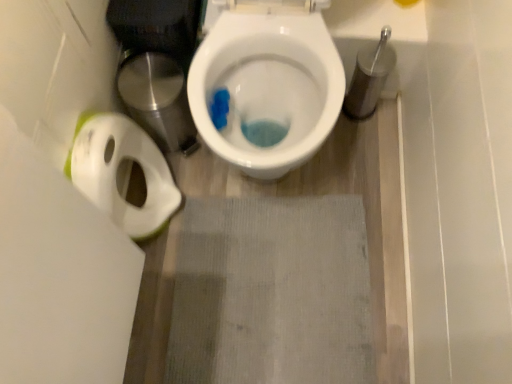
Image resolution: width=512 pixels, height=384 pixels. Describe the element at coordinates (158, 100) in the screenshot. I see `brushed metal potty at upper left` at that location.

Identify the location of brushed metal potty at upper left. (158, 100).

Measure the distance between brushed metal potty at upper left and camera.

brushed metal potty at upper left is 1.10 meters from camera.

Locate an element on the screen. The width and height of the screenshot is (512, 384). brushed metal potty at upper left is located at coordinates (158, 100).